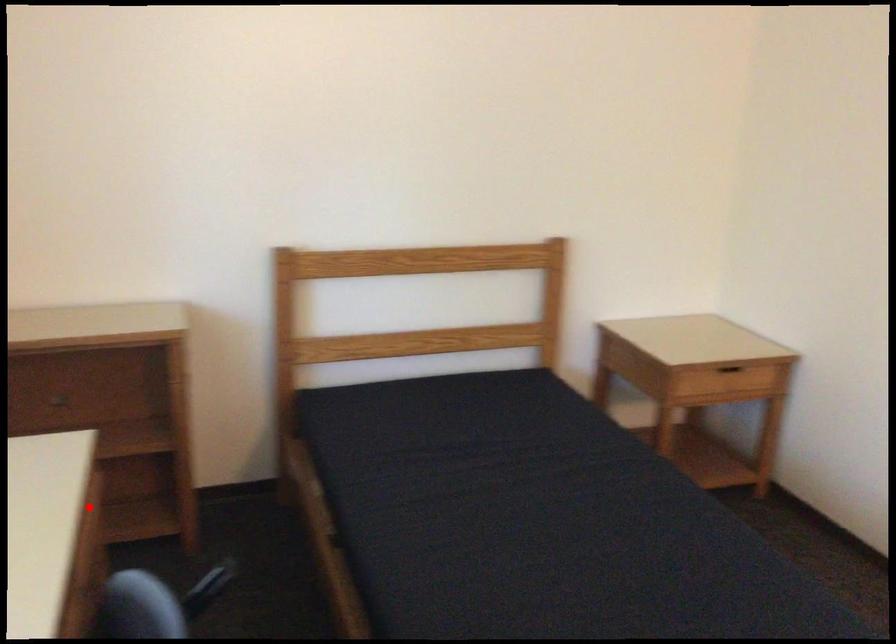
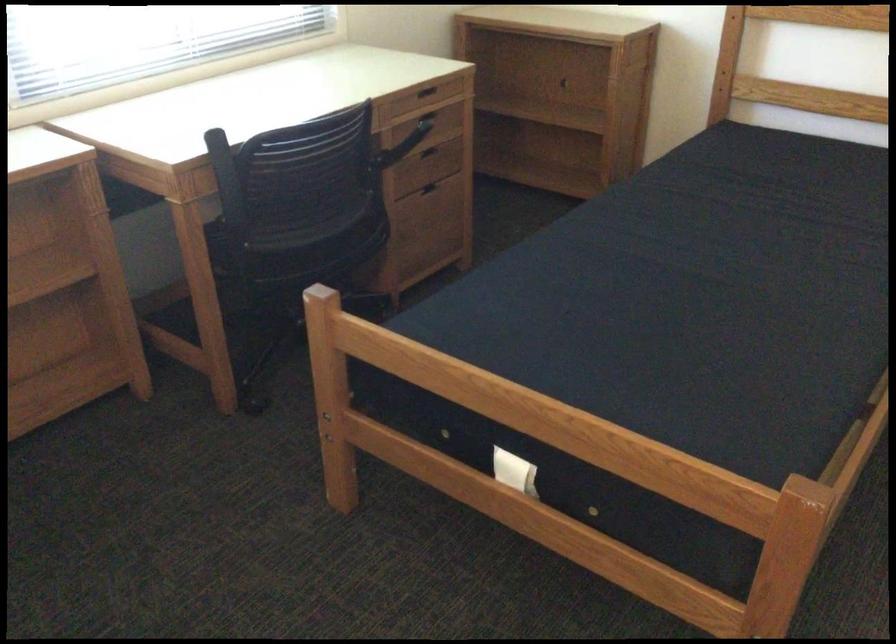
Question: A red point is marked in image1. In image2, is the corresponding 3D point closer to the camera or farther? Reply with the corresponding letter.

Choices:
 (A) The corresponding 3D point is closer.
 (B) The corresponding 3D point is farther.

Answer: (B)